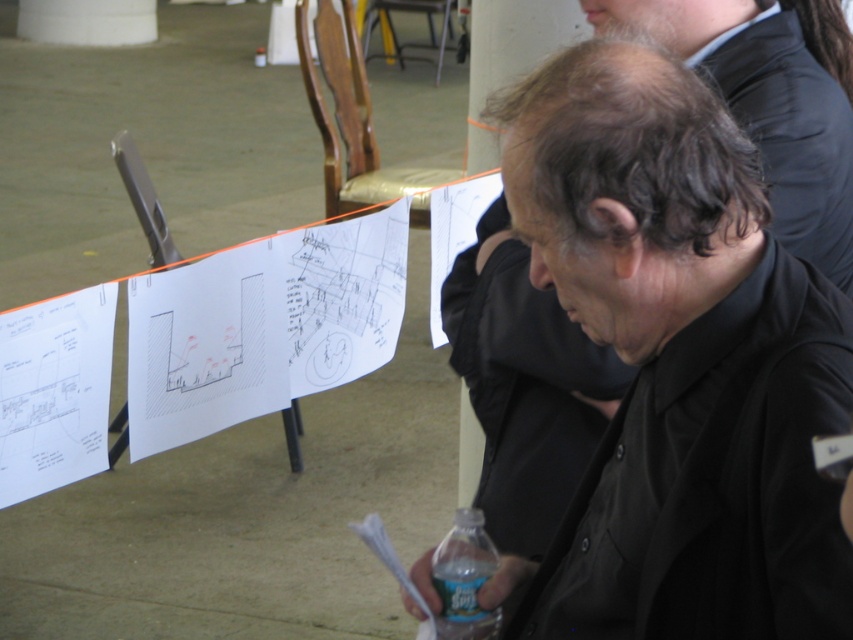
Is black matte shirt at center wider than black matte jacket at lower right?

Yes, black matte shirt at center is wider than black matte jacket at lower right.

Locate an element on the screen. black matte shirt at center is located at coordinates (679, 381).

Which is behind, point (784, 125) or point (782, 429)?

The point (784, 125) is more distant.

The image size is (853, 640). Identify the location of black matte shirt at center. (679, 381).

Who is more forward, (766, 536) or (438, 580)?

Positioned in front is point (766, 536).

Who is more distant from viewer, (573, 524) or (438, 552)?

The point (438, 552) is behind.

What do you see at coordinates (714, 481) in the screenshot? This screenshot has height=640, width=853. I see `black matte jacket at lower right` at bounding box center [714, 481].

Locate an element on the screen. Image resolution: width=853 pixels, height=640 pixels. black matte jacket at lower right is located at coordinates (714, 481).

Is point (805, 390) in front of point (51, 362)?

That is True.

Is the position of black matte shirt at center less distant than that of white paper at left?

That is True.

Where is `black matte shirt at center`? The image size is (853, 640). black matte shirt at center is located at coordinates (679, 381).